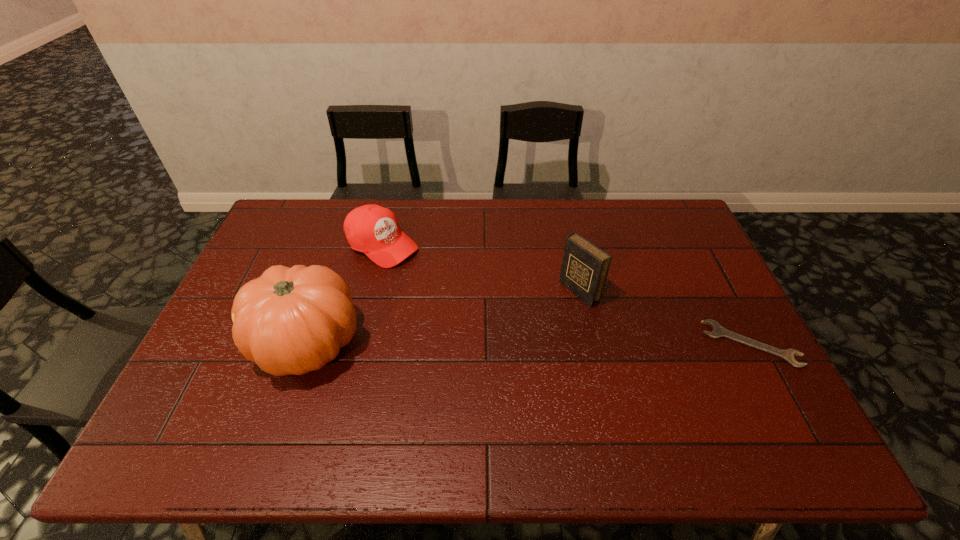
Identify the location of free space located 0.160m on the front cover of the third object from left to right. The width and height of the screenshot is (960, 540). (526, 328).

Image resolution: width=960 pixels, height=540 pixels. I want to click on vacant space situated 0.280m on the front cover of the third object from left to right, so click(x=492, y=349).

Locate an element on the screen. This screenshot has width=960, height=540. free region located on the front cover of the third object from left to right is located at coordinates (537, 321).

Where is `vacant area situated 0.180m on the front panel of the third tallest object`? Image resolution: width=960 pixels, height=540 pixels. vacant area situated 0.180m on the front panel of the third tallest object is located at coordinates (448, 286).

The width and height of the screenshot is (960, 540). In order to click on free point located on the front panel of the third tallest object in this screenshot , I will do `click(435, 276)`.

You are a GUI agent. You are given a task and a screenshot of the screen. Output one action in this format:
    pyautogui.click(x=<x>, y=<y>)
    Task: Click on the vacant space positioned 0.060m on the front panel of the third tallest object
    
    Given the screenshot: What is the action you would take?
    pyautogui.click(x=421, y=268)

I want to click on object positioned at the far edge, so click(372, 229).

You are a GUI agent. You are given a task and a screenshot of the screen. Output one action in this format:
    pyautogui.click(x=<x>, y=<y>)
    Task: Click on the object that is at the near edge
    The height and width of the screenshot is (540, 960).
    Given the screenshot: What is the action you would take?
    pyautogui.click(x=294, y=320)

Locate an element on the screen. Image resolution: width=960 pixels, height=540 pixels. object that is positioned at the left edge is located at coordinates (294, 320).

Find the location of a particular element. This screenshot has width=960, height=540. object that is at the right edge is located at coordinates (718, 331).